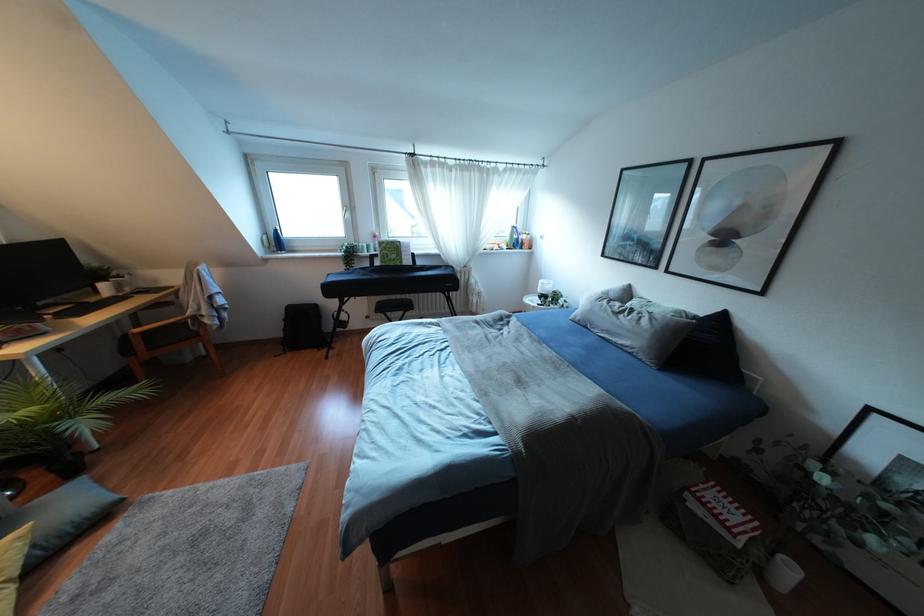
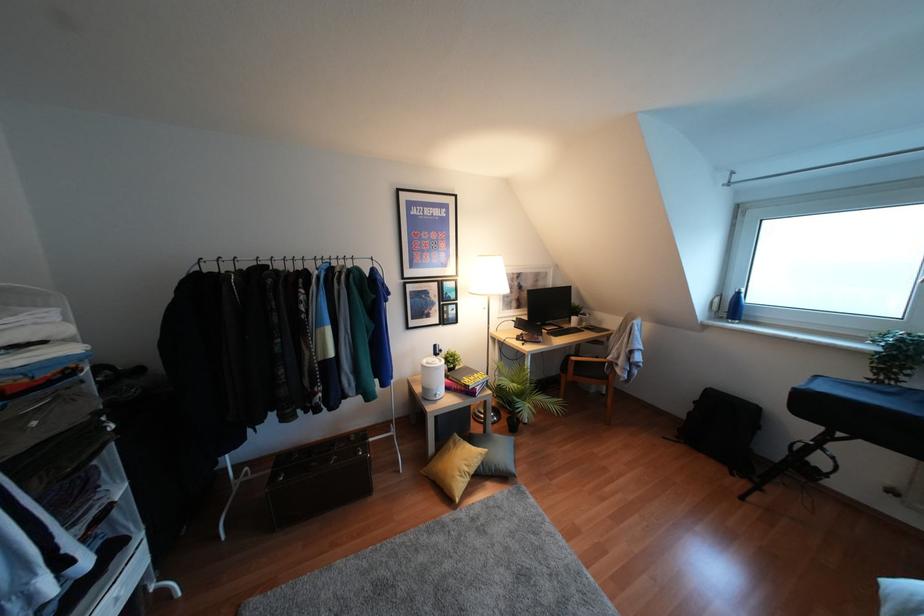
Question: The first image is from the beginning of the video and the second image is from the end. How did the camera likely rotate when shooting the video?

Choices:
 (A) Left
 (B) Right
 (C) Up
 (D) Down

Answer: (A)